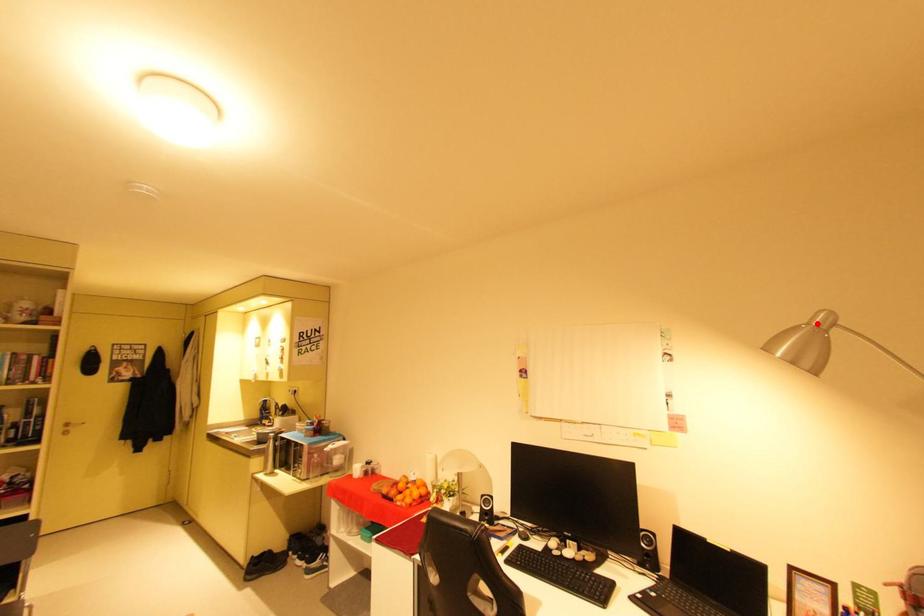
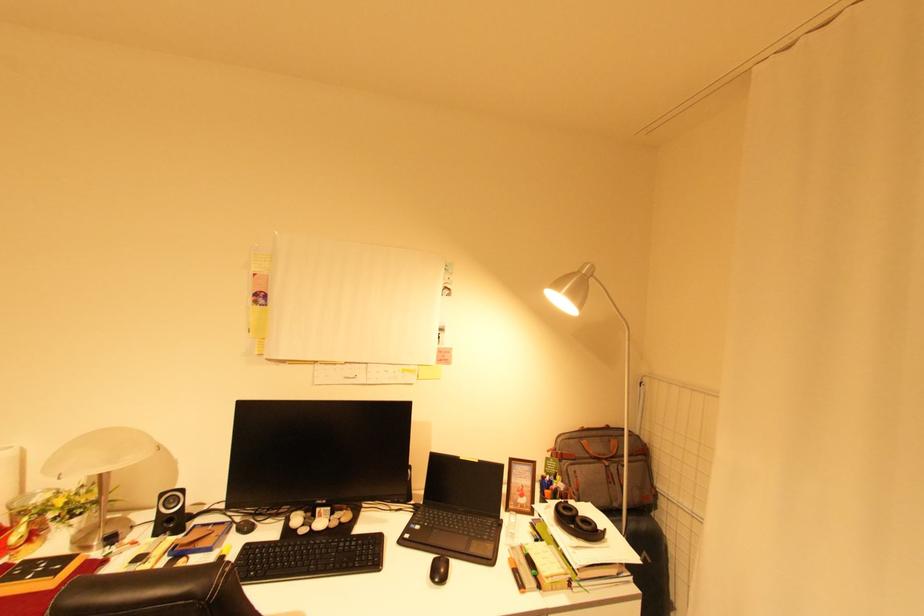
Question: I am providing you with two images of the same scene from different viewpoints. A red point is marked on the first image. At the location where the point appears in image 1, is it still visible in image 2?

Choices:
 (A) Yes
 (B) No

Answer: (A)